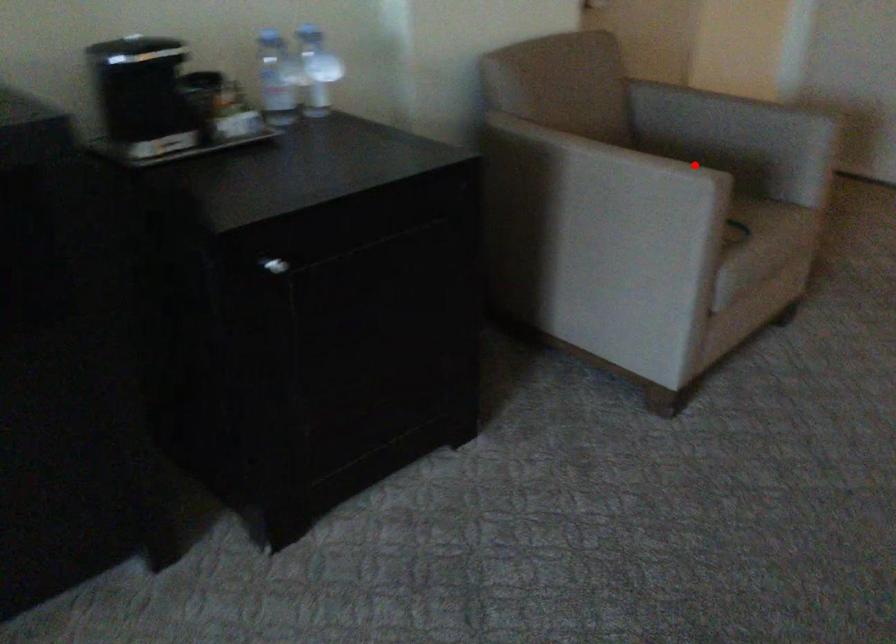
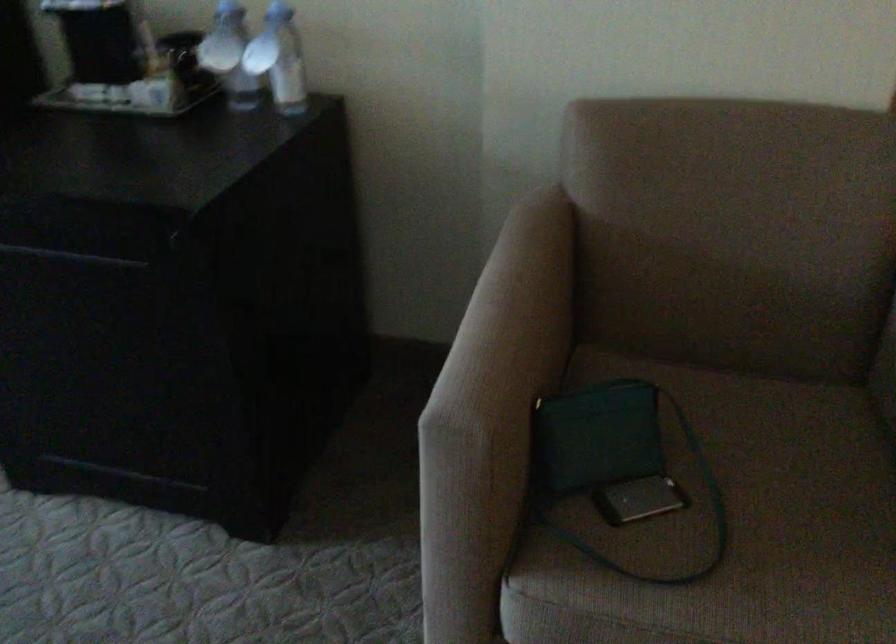
Where in the second image is the point corresponding to the highlighted location from the first image?

(495, 390)